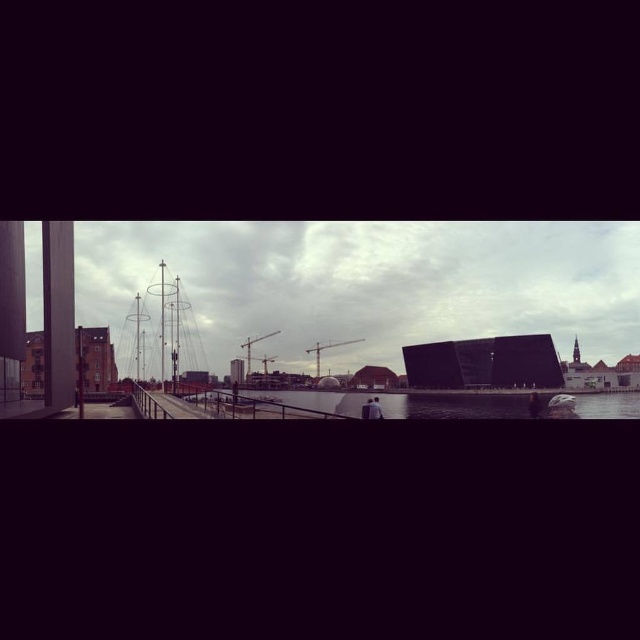
Does transparent glass water at center have a lesser height compared to metallic bridge at center?

Yes, transparent glass water at center is shorter than metallic bridge at center.

Is transparent glass water at center bigger than metallic bridge at center?

No, transparent glass water at center is not bigger than metallic bridge at center.

Is point (428, 394) behind point (154, 358)?

No, it is in front of (154, 358).

I want to click on transparent glass water at center, so click(x=452, y=404).